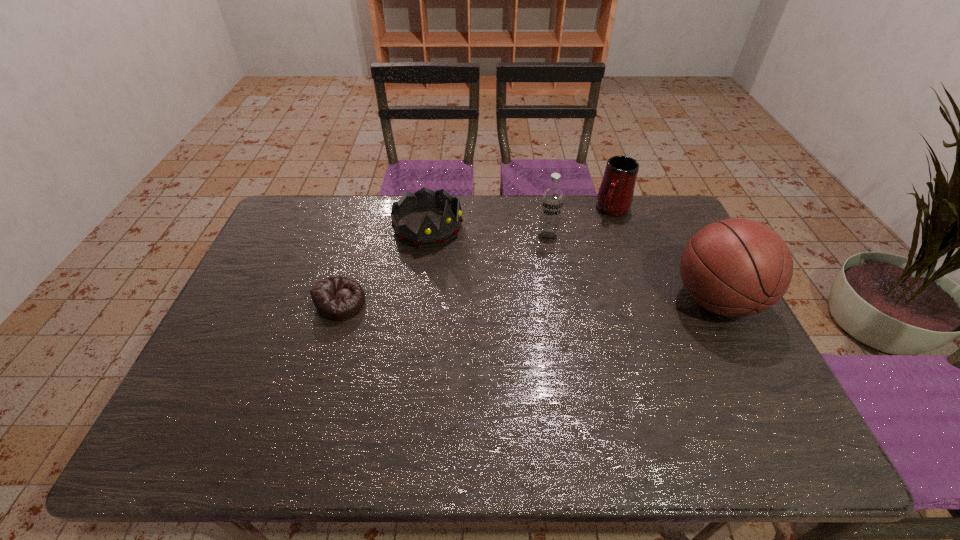
At what (x,y) coordinates should I click in order to perform the action: click on the closest object relative to the fourth object from right to left. Please return your answer as a coordinate pair (x, y). Image resolution: width=960 pixels, height=540 pixels. Looking at the image, I should click on (338, 298).

The width and height of the screenshot is (960, 540). In order to click on free point that satisfies the following two spatial constraints: 1. on the front side of the vodka; 2. on the right side of the basketball in this screenshot , I will do `click(558, 301)`.

Where is `vacant region that satisfies the following two spatial constraints: 1. on the back side of the second object from left to right; 2. on the right side of the shortest object`? Image resolution: width=960 pixels, height=540 pixels. vacant region that satisfies the following two spatial constraints: 1. on the back side of the second object from left to right; 2. on the right side of the shortest object is located at coordinates (363, 227).

Find the location of a particular element. free spot that satisfies the following two spatial constraints: 1. on the front side of the mug; 2. on the right side of the basketball is located at coordinates (646, 301).

Locate an element on the screen. free region that satisfies the following two spatial constraints: 1. on the front side of the fourth object from right to left; 2. on the left side of the vodka is located at coordinates click(427, 238).